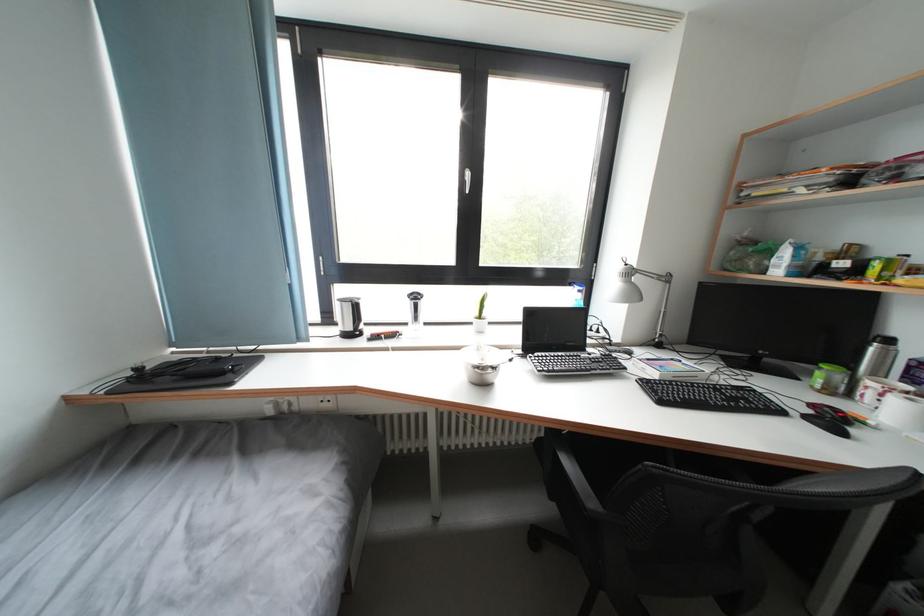
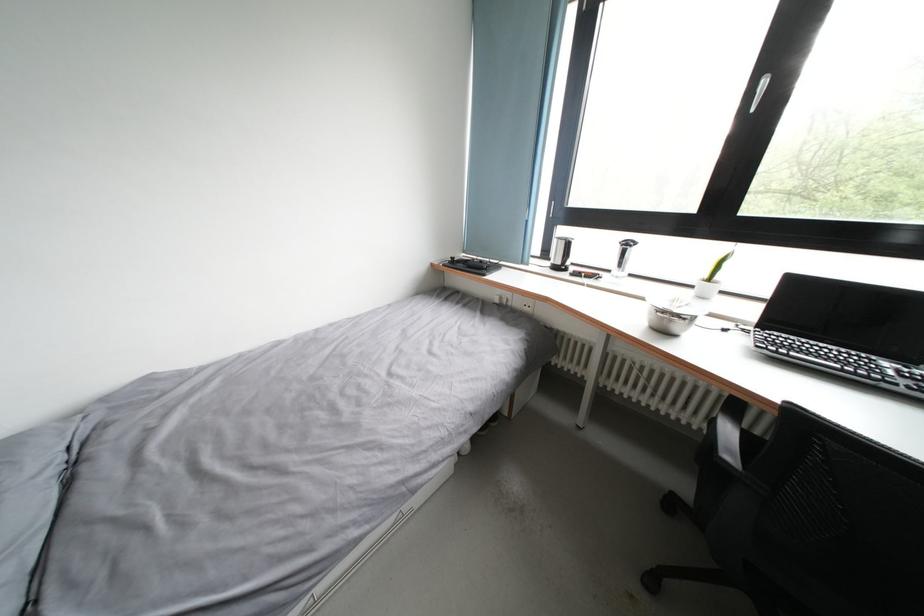
The point at (284, 410) is marked in the first image. Where is the corresponding point in the second image?

(507, 302)